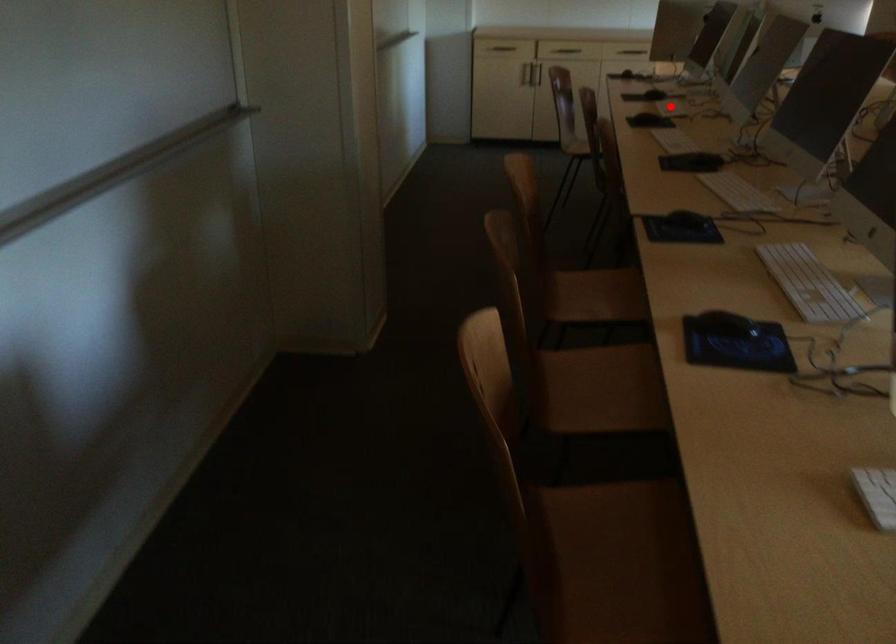
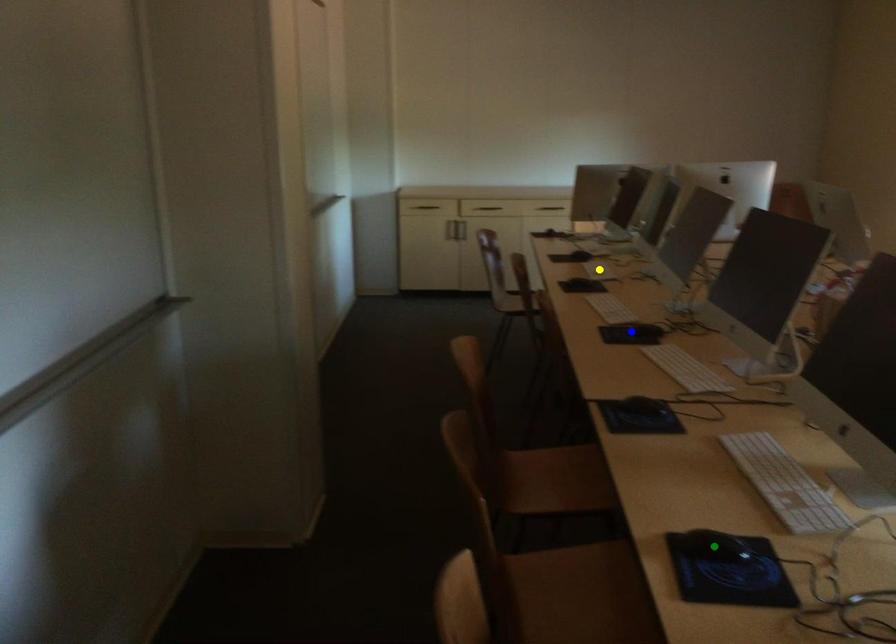
Question: I am providing you with two images of the same scene from different viewpoints. A red point is marked on the first image. You are given multiple points on the second image. Can you choose the point in image 2 that corresponds to the point in image 1?

Choices:
 (A) blue point
 (B) green point
 (C) yellow point

Answer: (C)